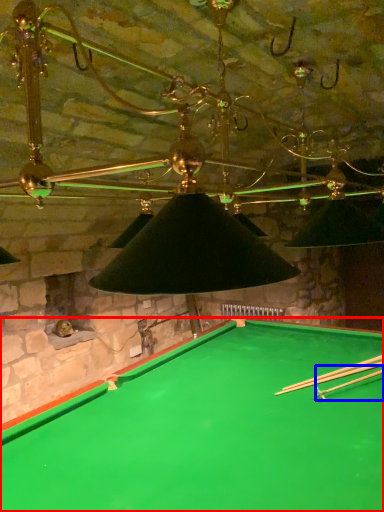
Question: Which object is closer to the camera taking this photo, billiard table (highlighted by a red box) or cue (highlighted by a blue box)?

Choices:
 (A) billiard table
 (B) cue

Answer: (A)